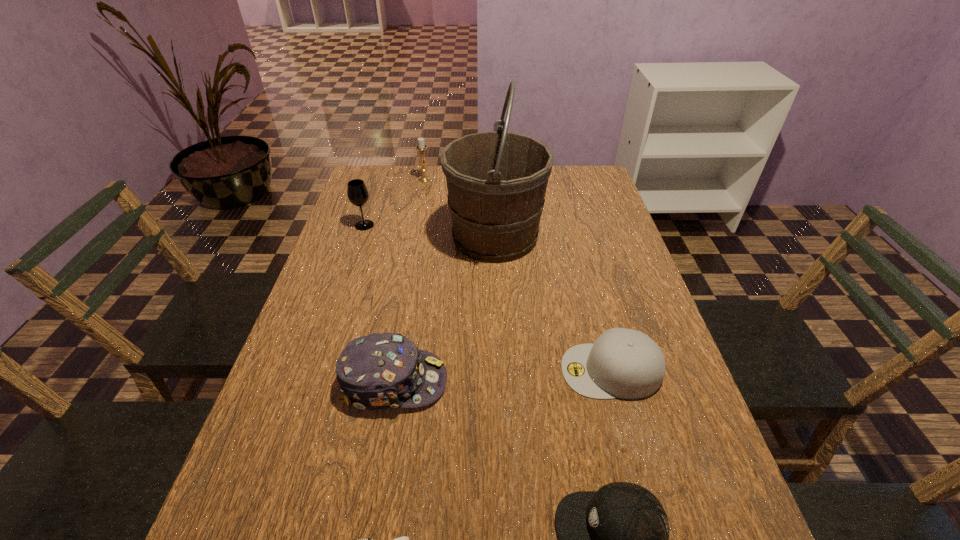
Locate an element on the screen. bucket is located at coordinates (496, 181).

Where is `the farthest object`? Image resolution: width=960 pixels, height=540 pixels. the farthest object is located at coordinates (421, 147).

The width and height of the screenshot is (960, 540). What are the coordinates of `the leftmost object` in the screenshot? It's located at (357, 192).

At what (x,y) coordinates should I click in order to perform the action: click on the leftmost cap. Please return your answer as a coordinate pair (x, y). The width and height of the screenshot is (960, 540). Looking at the image, I should click on (379, 371).

Identify the location of free region located 0.050m on the back of the bucket. The width and height of the screenshot is (960, 540). (493, 199).

This screenshot has height=540, width=960. In order to click on free space located on the left of the farthest object in this screenshot , I will do `click(402, 179)`.

The width and height of the screenshot is (960, 540). What are the coordinates of `vacant space located on the right of the wineglass` in the screenshot? It's located at (482, 225).

I want to click on vacant space located on the front-facing side of the leftmost cap, so click(608, 381).

At what (x,y) coordinates should I click in order to perform the action: click on object at the far edge. Please return your answer as a coordinate pair (x, y). Looking at the image, I should click on (421, 147).

You are a GUI agent. You are given a task and a screenshot of the screen. Output one action in this format:
    pyautogui.click(x=<x>, y=<y>)
    Task: Click on the wineglass present at the left edge
    This screenshot has width=960, height=540.
    Given the screenshot: What is the action you would take?
    pyautogui.click(x=357, y=192)